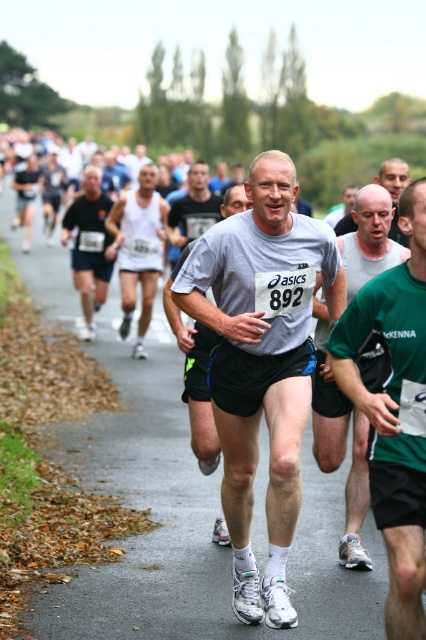
Is white fabric runner at center shorter than green fabric shirt at center?

Incorrect, white fabric runner at center's height does not fall short of green fabric shirt at center's.

Is point (210, 541) closer to camera compared to point (351, 557)?

No, it is not.

Where is `white fabric runner at center`? This screenshot has height=640, width=426. white fabric runner at center is located at coordinates pos(190,522).

Who is more distant from viewer, (80, 264) or (380, 164)?

The point (380, 164) is more distant.

Identify the location of matte black shorts at left. This screenshot has height=640, width=426. (89, 244).

The width and height of the screenshot is (426, 640). Identify the location of matte black shorts at left. (89, 244).

Between white fabric runner at center and matte gray t-shirt at center, which one is positioned lower?

matte gray t-shirt at center

Which is in front, point (336, 509) or point (230, 358)?

Positioned in front is point (230, 358).

You are a GUI agent. You are given a task and a screenshot of the screen. Output one action in this format:
    pyautogui.click(x=<x>, y=<y>)
    Task: Click on the white fabric runner at center
    
    Given the screenshot: What is the action you would take?
    pyautogui.click(x=190, y=522)